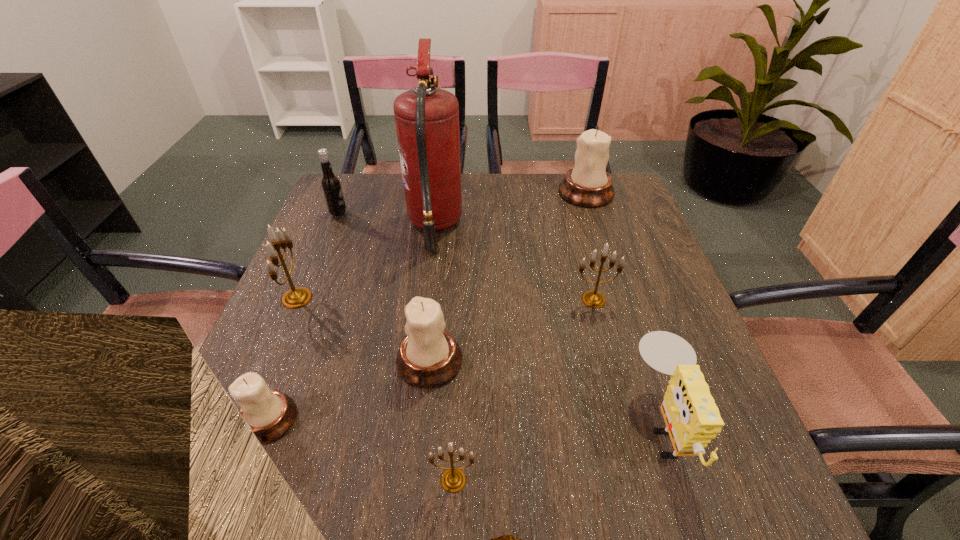
You are a GUI agent. You are given a task and a screenshot of the screen. Output one action in this format:
    pyautogui.click(x=<x>, y=<y>)
    Task: Click on the red fire extinguisher
    This screenshot has width=960, height=540.
    Given the screenshot: What is the action you would take?
    pyautogui.click(x=427, y=119)

Where is `the tallest object`? This screenshot has height=540, width=960. the tallest object is located at coordinates (427, 119).

Locate an element on the screen. the farthest white candle holder is located at coordinates (588, 184).

This screenshot has height=540, width=960. In order to click on the rightmost white candle holder in this screenshot , I will do `click(588, 184)`.

The image size is (960, 540). Find the location of `the leftmost gold candelabrum`. the leftmost gold candelabrum is located at coordinates (297, 297).

Find the location of `root beer`. root beer is located at coordinates (330, 183).

Image resolution: width=960 pixels, height=540 pixels. What are the coordinates of `the second biggest white candle holder` in the screenshot? It's located at (429, 356).

You are a GUI agent. You are given a task and a screenshot of the screen. Output one action in this format:
    pyautogui.click(x=<x>, y=<y>)
    Task: Click on the fourth farthest candelabrum
    
    Given the screenshot: What is the action you would take?
    pyautogui.click(x=429, y=356)

This screenshot has height=540, width=960. I want to click on the rightmost gold candelabrum, so click(593, 299).

You are a GUI agent. You are given a task and a screenshot of the screen. Output one action in this format:
    pyautogui.click(x=<x>, y=<y>)
    Task: Click on the sponge
    This screenshot has height=540, width=960.
    Given the screenshot: What is the action you would take?
    pyautogui.click(x=692, y=418)